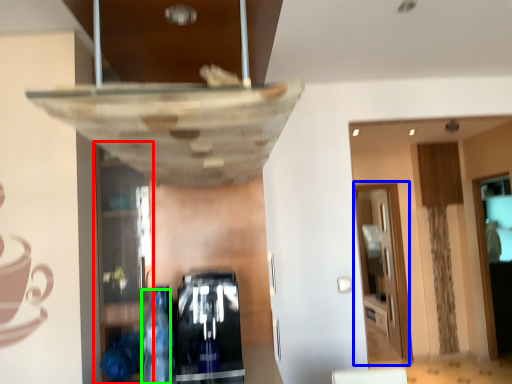
Question: Which object is positioned closest to shelf (highlighted by a red box)? Select from glass door (highlighted by a blue box) and bottle (highlighted by a green box).

Choices:
 (A) glass door
 (B) bottle

Answer: (B)